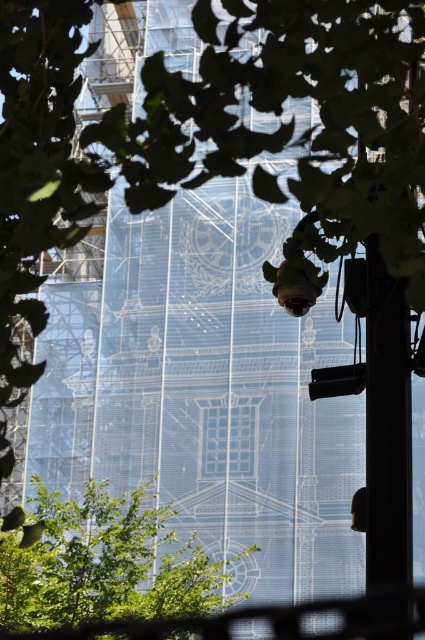
Question: Is green leafy tree at center positioned behind black matte pole at right?

Choices:
 (A) yes
 (B) no

Answer: (A)

Question: Which object appears closest to the camera in this image?

Choices:
 (A) black matte pole at right
 (B) green leafy tree at center

Answer: (A)

Question: Is green leafy tree at center behind black matte pole at right?

Choices:
 (A) no
 (B) yes

Answer: (B)

Question: Does green leafy tree at center appear under black matte pole at right?

Choices:
 (A) yes
 (B) no

Answer: (A)